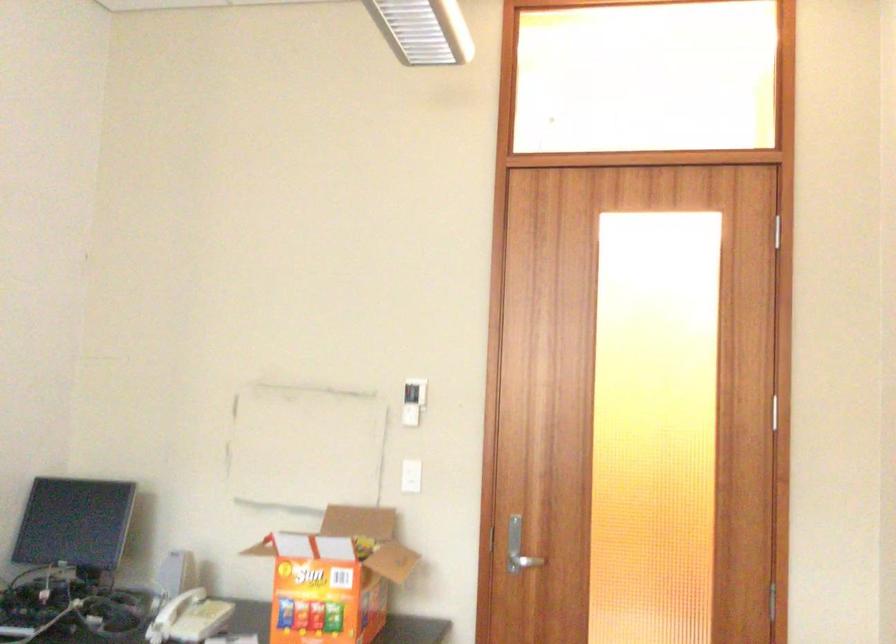
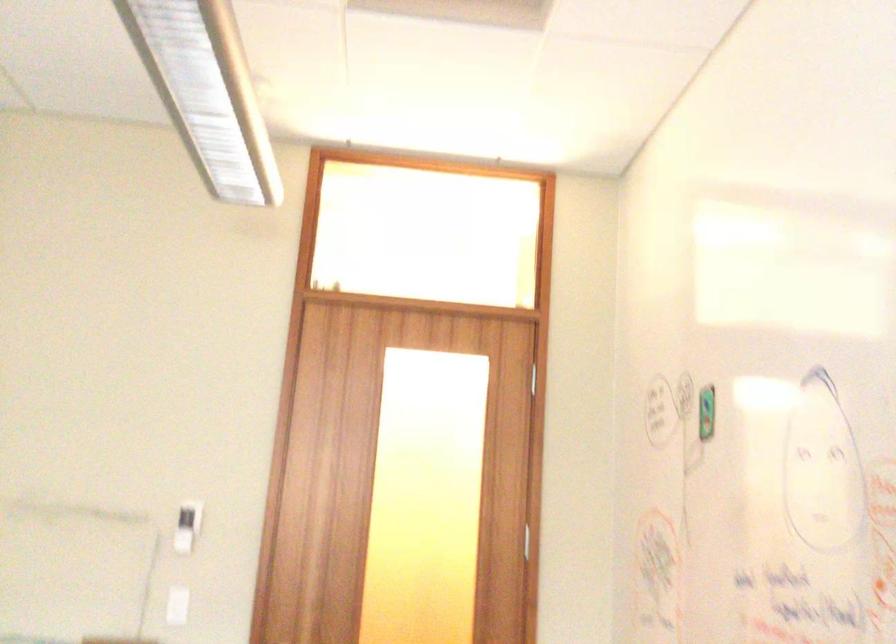
Question: The first image is from the beginning of the video and the second image is from the end. How did the camera likely rotate when shooting the video?

Choices:
 (A) Left
 (B) Right
 (C) Up
 (D) Down

Answer: (B)